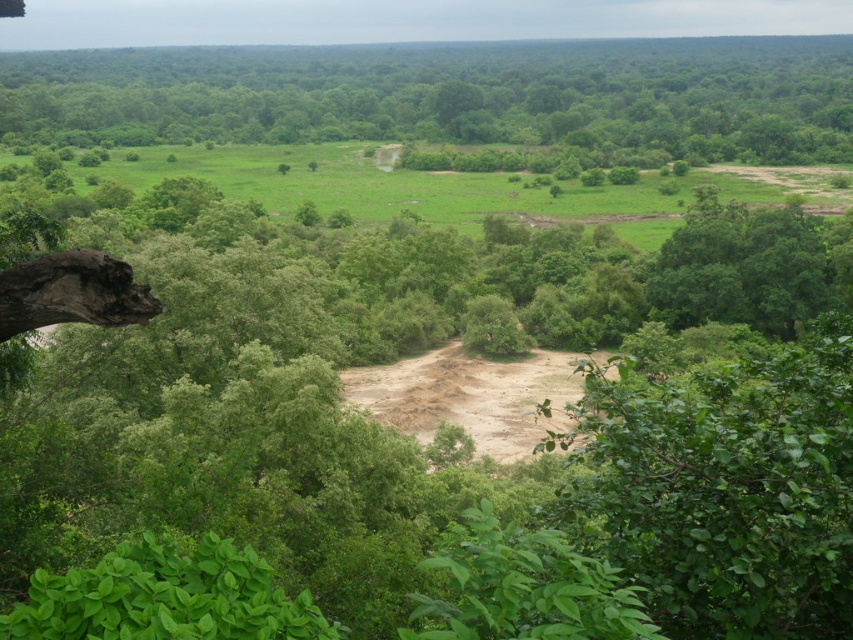
Is point (15, 96) farther from camera compared to point (450, 378)?

Yes, it is.

Which of these two, green leafy tree at upper left or brown sandy dirt track at center, stands shorter?

Standing shorter between the two is brown sandy dirt track at center.

Is point (621, 72) more distant than point (520, 369)?

That is True.

Find the location of a particular element. green leafy tree at upper left is located at coordinates (450, 96).